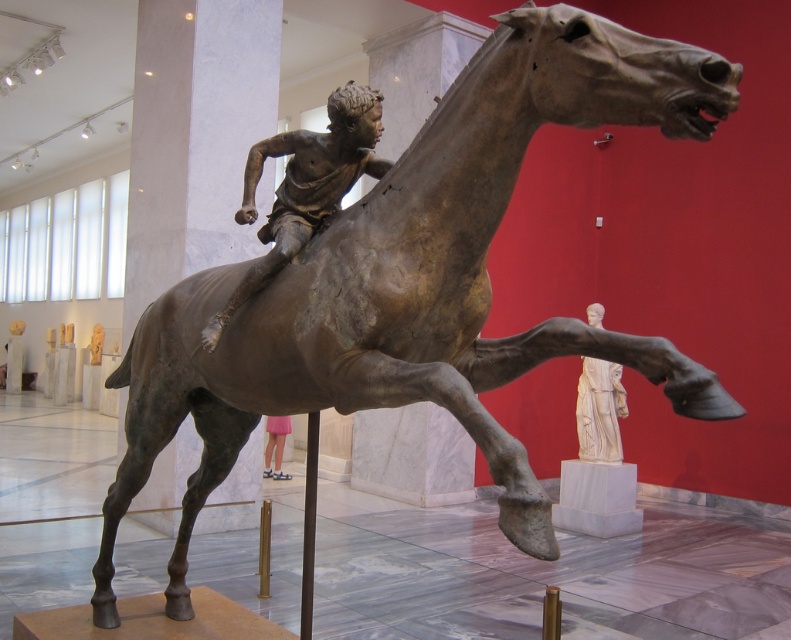
Question: Observing the image, what is the correct spatial positioning of bronze figure at center in reference to pink fabric skirt at lower center?

Choices:
 (A) above
 (B) below

Answer: (A)

Question: Can you confirm if bronze figure at center is positioned above white marble statue at right?

Choices:
 (A) yes
 (B) no

Answer: (A)

Question: Which object is closer to the camera taking this photo?

Choices:
 (A) white marble statue at right
 (B) pink fabric skirt at lower center
 (C) bronze figure at center

Answer: (C)

Question: Considering the relative positions of bronze figure at center and pink fabric skirt at lower center in the image provided, where is bronze figure at center located with respect to pink fabric skirt at lower center?

Choices:
 (A) left
 (B) right

Answer: (B)

Question: Which object is closer to the camera taking this photo?

Choices:
 (A) bronze figure at center
 (B) white marble statue at right

Answer: (A)

Question: Which object is farther from the camera taking this photo?

Choices:
 (A) white marble statue at right
 (B) pink fabric skirt at lower center

Answer: (B)